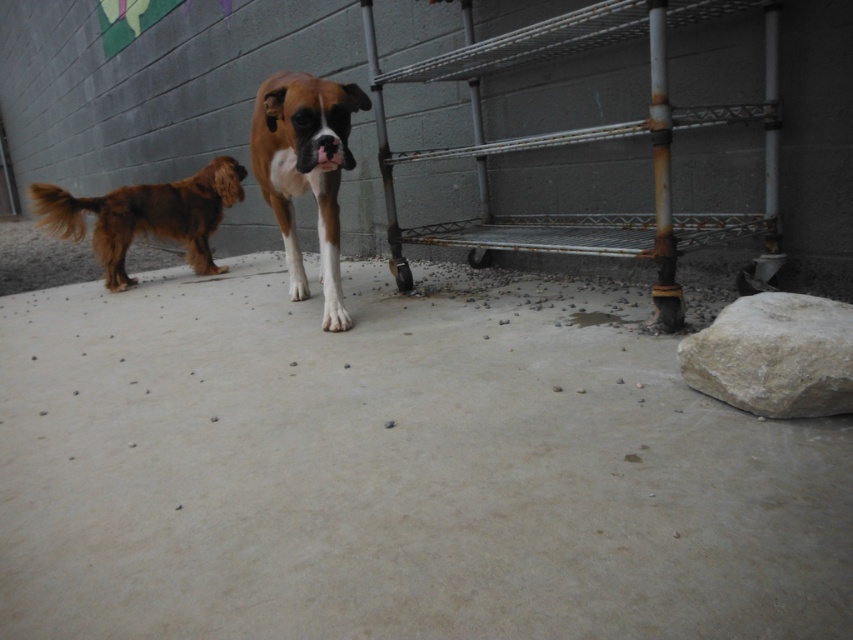
You are a dog trainer assessing the space needed for two dogs in the kennel. The brown matte dog at center and the shiny brown fur at left are both present. Which dog requires more space due to its larger size?

The shiny brown fur at left requires more space because its width is greater than the brown matte dog at center.

You are standing at the camera position and want to pick up an object located at point (x=772, y=216). The maximum distance you can reach is 7 feet. Can you reach it?

The point (x=772, y=216) is 7.99 feet away from the camera, so you cannot reach it since it exceeds your maximum reach of 7 feet.

You are a dog owner who wants to throw a tennis ball from the shiny brown fur at left to the white rough rock at right. Can the dog reach the rock if it can jump 4 meters?

The distance between the shiny brown fur at left and the white rough rock at right is 3.97 meters. Since the dog can jump 4 meters, it can easily reach the rock.